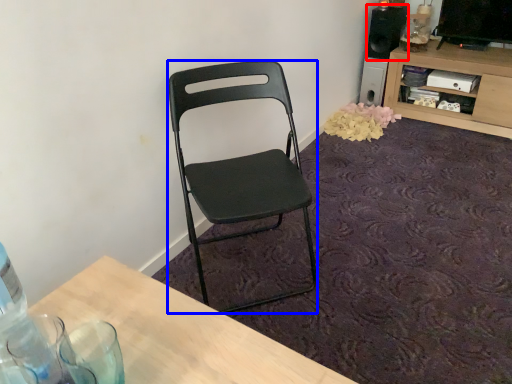
Question: Which object appears farthest to the camera in this image, loudspeaker (highlighted by a red box) or chair (highlighted by a blue box)?

Choices:
 (A) loudspeaker
 (B) chair

Answer: (A)